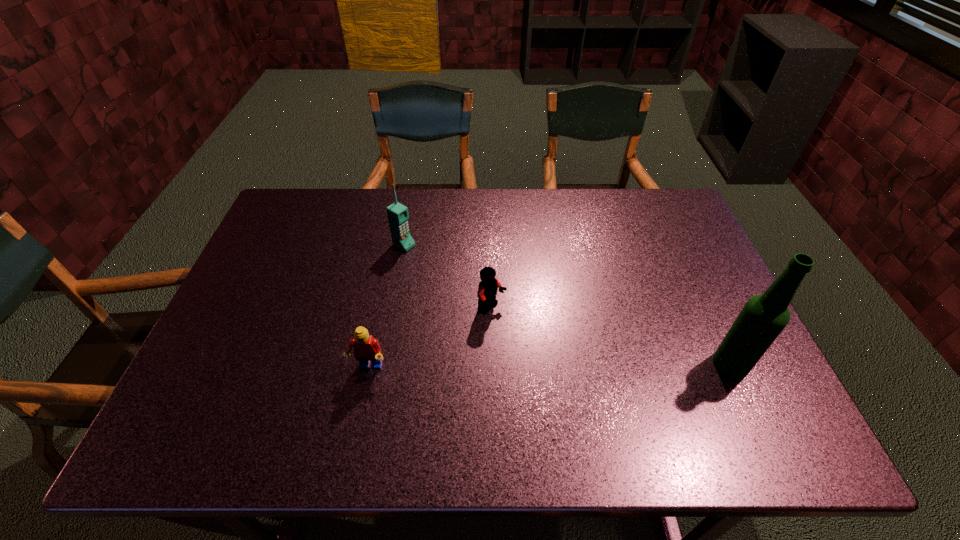
I want to click on vacant point located between the tallest object and the farthest object, so click(x=567, y=305).

I want to click on vacant space that's between the cellular telephone and the rightmost object, so click(567, 305).

Image resolution: width=960 pixels, height=540 pixels. Find the location of `free space that is in between the second farthest object and the cellular telephone`. free space that is in between the second farthest object and the cellular telephone is located at coordinates (448, 277).

Where is `object that is the third nearest to the tallest object`? This screenshot has height=540, width=960. object that is the third nearest to the tallest object is located at coordinates (397, 213).

This screenshot has height=540, width=960. I want to click on object identified as the closest to the left Lego, so click(x=487, y=290).

Locate an element on the screen. vacant space that satisfies the following two spatial constraints: 1. on the front side of the third nearest object; 2. on the label of the beer bottle is located at coordinates (493, 364).

Find the location of `free spot that satisfies the following two spatial constraints: 1. on the front side of the rightmost object; 2. on the label of the second tallest object`. free spot that satisfies the following two spatial constraints: 1. on the front side of the rightmost object; 2. on the label of the second tallest object is located at coordinates (383, 364).